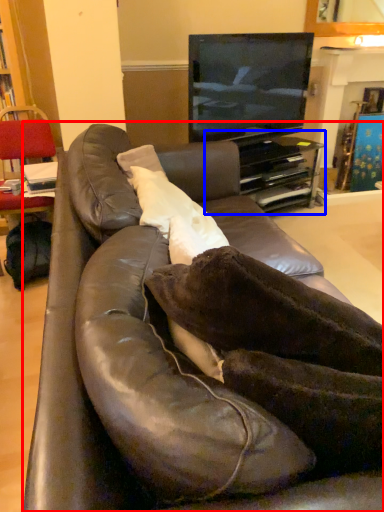
Question: Among these objects, which one is nearest to the camera, studio couch (highlighted by a red box) or entertainment center (highlighted by a blue box)?

Choices:
 (A) studio couch
 (B) entertainment center

Answer: (A)